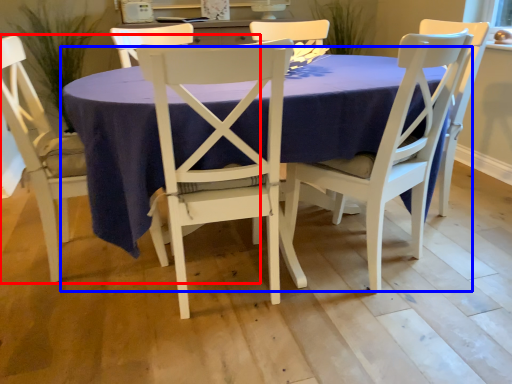
Question: Among these objects, which one is farthest to the camera, chair (highlighted by a red box) or kitchen & dining room table (highlighted by a blue box)?

Choices:
 (A) chair
 (B) kitchen & dining room table

Answer: (A)